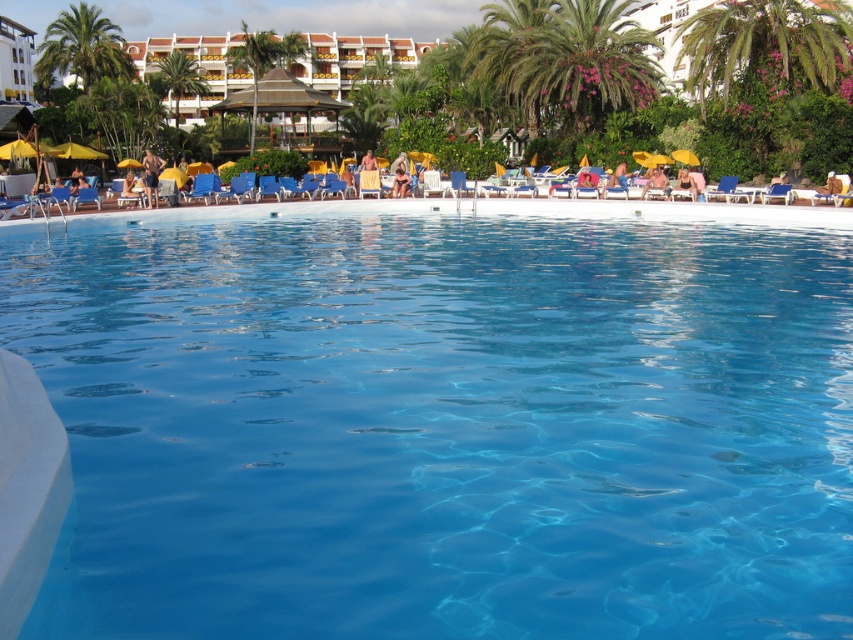
You are standing at the edge of the pool and see the transparent glass pool at center and the tan skin person at center. Which object is closer to your right side?

The transparent glass pool at center is closer to your right side because it is positioned to the right of the tan skin person at center.

You are standing at the edge of the pool and want to sit down on the beige fabric beach chair at center. Which direction should you move relative to the tan skin person at center?

You should move to the right relative to the tan skin person at center to reach the beige fabric beach chair at center since it is positioned to the right of them.

You are standing at the edge of the pool and want to place a new blue lounge chair. The current beige fabric beach chair at center is located at coordinates 0.287, 0.434. If you want to place the new chair 1 meter to the right of the existing one, what coordinates should you use?

To place the new blue lounge chair 1 meter to the right of the beige fabric beach chair at center at coordinates (369, 182), you would adjust the x coordinate by adding 1 meter. The new coordinates would be approximately (369, 182) plus 1 meter in the x direction. However, without knowing the scale of the coordinate system, precise calculation isn